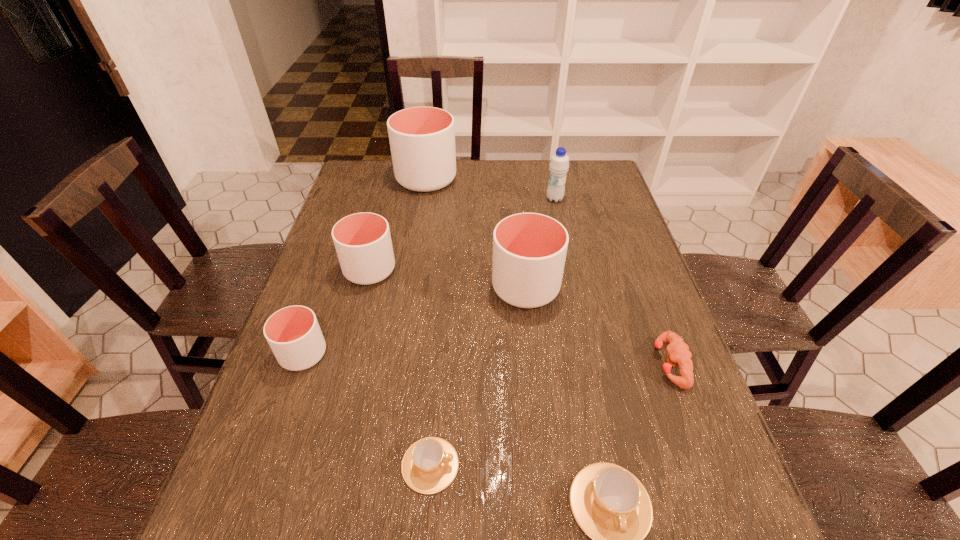
Locate an element on the screen. free location located with the gloves of the puncher facing forward is located at coordinates [619, 363].

Identify the location of vacant point located with the handle on the side of the shortest cup. The image size is (960, 540). (612, 465).

You are a GUI agent. You are given a task and a screenshot of the screen. Output one action in this format:
    pyautogui.click(x=<x>, y=<y>)
    Task: Click on the cup located at the far edge
    The image size is (960, 540).
    Given the screenshot: What is the action you would take?
    pyautogui.click(x=422, y=139)

Locate an element on the screen. This screenshot has width=960, height=540. water bottle situated at the far edge is located at coordinates (559, 164).

Where is `object positioned at the right edge`? Image resolution: width=960 pixels, height=540 pixels. object positioned at the right edge is located at coordinates (678, 352).

The image size is (960, 540). I want to click on vacant point at the far edge, so click(x=494, y=192).

Image resolution: width=960 pixels, height=540 pixels. In the image, there is a desktop. Identify the location of vacant region at the left edge. (253, 411).

What are the coordinates of `vacant point at the right edge` in the screenshot? It's located at (625, 244).

Locate an element on the screen. vacant space at the far left corner of the desktop is located at coordinates (383, 171).

Locate an element on the screen. vacant space at the near left corner of the desktop is located at coordinates (264, 521).